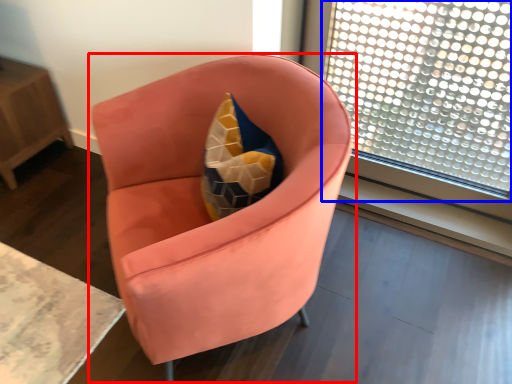
Question: Which object is closer to the camera taking this photo, chair (highlighted by a red box) or window (highlighted by a blue box)?

Choices:
 (A) chair
 (B) window

Answer: (A)